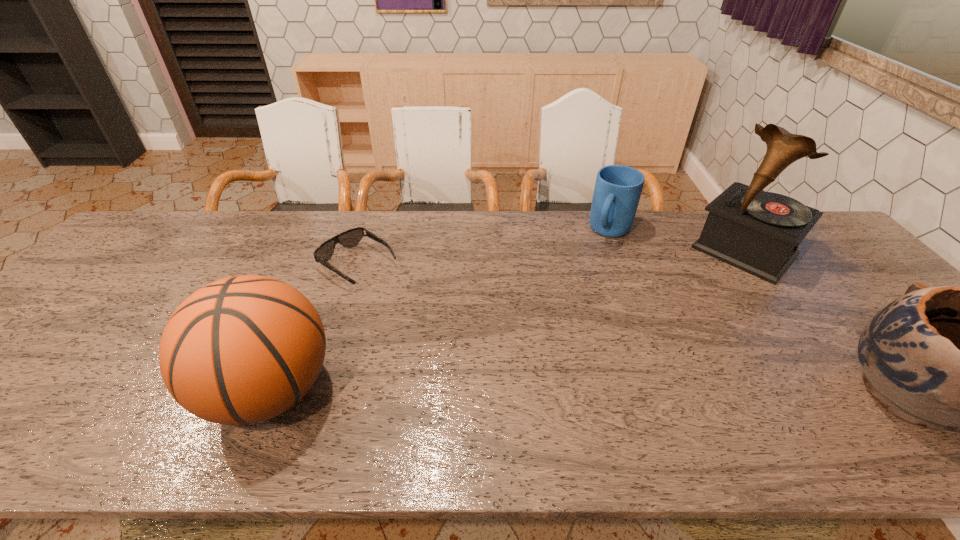
I want to click on free space located 0.250m on the front-facing side of the sunglasses, so click(x=448, y=326).

The width and height of the screenshot is (960, 540). What are the coordinates of `free space located on the front-facing side of the sunglasses` in the screenshot? It's located at (466, 338).

Find the location of a particular element. Image resolution: width=960 pixels, height=540 pixels. vacant area located at the horn opening of the tallest object is located at coordinates (673, 328).

Find the location of a particular element. Image resolution: width=960 pixels, height=540 pixels. free space located 0.100m at the horn opening of the tallest object is located at coordinates (707, 292).

I want to click on vacant space located at the horn opening of the tallest object, so click(x=681, y=320).

Find the location of a particular element. mug present at the far edge is located at coordinates (617, 191).

You are a GUI agent. You are given a task and a screenshot of the screen. Output one action in this format:
    pyautogui.click(x=<x>, y=<y>)
    Task: Click on the sunglasses that is at the far edge
    The image size is (960, 540).
    Given the screenshot: What is the action you would take?
    pyautogui.click(x=352, y=237)

You are a GUI agent. You are given a task and a screenshot of the screen. Output one action in this format:
    pyautogui.click(x=<x>, y=<y>)
    Task: Click on the phonograph_record positioned at the far edge
    
    Given the screenshot: What is the action you would take?
    pyautogui.click(x=758, y=232)

This screenshot has height=540, width=960. Identify the location of object that is at the near edge. (244, 349).

This screenshot has width=960, height=540. What are the coordinates of `object at the right edge` in the screenshot? It's located at (758, 232).